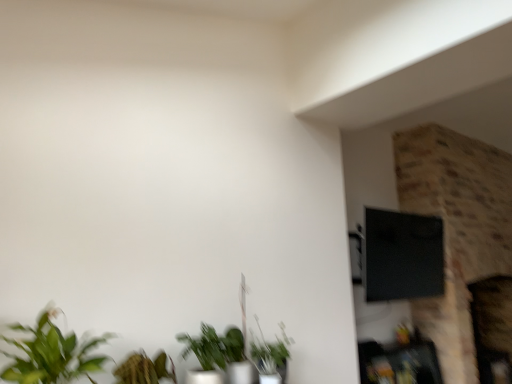
Question: From the image's perspective, is green matte plant at lower center, the third houseplant positioned from the left, above or below wooden shelf at lower right?

Choices:
 (A) below
 (B) above

Answer: (B)

Question: Considering the relative positions of green matte plant at lower center, the third houseplant viewed from the front, and wooden shelf at lower right in the image provided, is green matte plant at lower center, the third houseplant viewed from the front, to the left or to the right of wooden shelf at lower right?

Choices:
 (A) right
 (B) left

Answer: (B)

Question: Which object is positioned closest to the green leafy plant at lower left, which is the 1th houseplant in left-to-right order?

Choices:
 (A) green matte plant at lower center, the 1th houseplant positioned from the back
 (B) green matte plant at lower center, the 2th houseplant viewed from the back
 (C) wooden shelf at lower right

Answer: (B)

Question: Which object is positioned closest to the wooden shelf at lower right?

Choices:
 (A) green matte plant at lower center, the third houseplant positioned from the left
 (B) green matte plant at lower center, arranged as the 2th houseplant when viewed from the right
 (C) green leafy plant at lower left, which is the 1th houseplant in left-to-right order

Answer: (A)